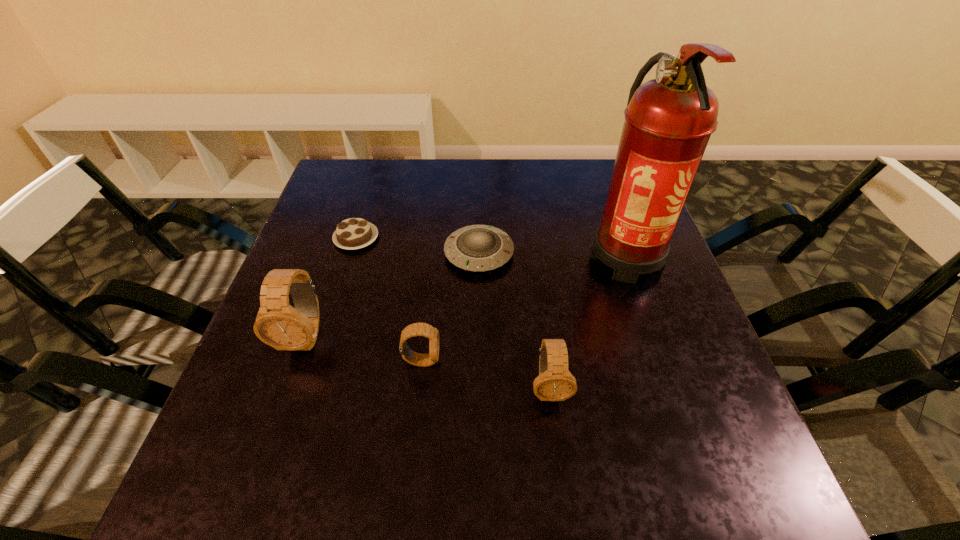
Where is `free space between the saucer and the third shortest object`? free space between the saucer and the third shortest object is located at coordinates (450, 307).

Where is `vacant space that is in between the second tallest object and the second shortest object`? The height and width of the screenshot is (540, 960). vacant space that is in between the second tallest object and the second shortest object is located at coordinates coord(393,295).

You are a GUI agent. You are given a task and a screenshot of the screen. Output one action in this format:
    pyautogui.click(x=<x>, y=<y>)
    Task: Click on the empty space that is in between the chocolate cake and the fifth tallest object
    
    Given the screenshot: What is the action you would take?
    pyautogui.click(x=418, y=246)

Image resolution: width=960 pixels, height=540 pixels. Identify the location of free space between the rightmost object and the saucer. (552, 254).

Find the location of a particular element. empty location between the fire extinguisher and the second watch from left to right is located at coordinates (523, 308).

Identify the location of free area in between the second watch from left to right and the chocolate cake. Image resolution: width=960 pixels, height=540 pixels. (389, 300).

Identify which object is located as the nearest to the leftmost watch. Please provide its 2D coordinates. Your answer should be formatted as a tuple, i.e. [(x, y)], where the tuple contains the x and y coordinates of a point satisfying the conditions above.

[(416, 329)]

Find the location of a particular element. Image resolution: width=960 pixels, height=540 pixels. the fifth closest object to the fifth object from left to right is located at coordinates (354, 233).

This screenshot has width=960, height=540. What are the coordinates of `watch that is the closest to the shortest watch` in the screenshot? It's located at (279, 325).

In order to click on watch identified as the second closest to the second shortest object in this screenshot , I will do `click(279, 325)`.